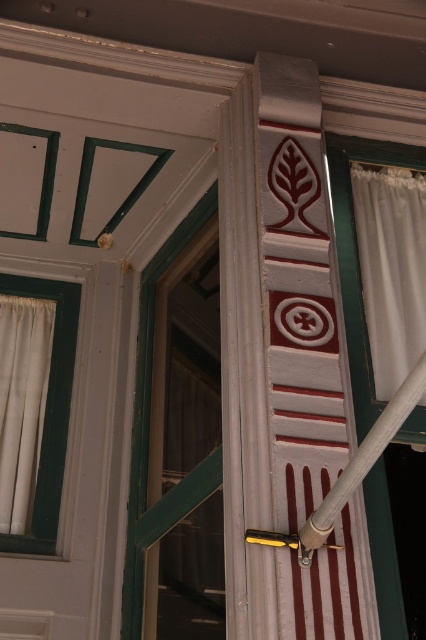
Question: Which of these objects is positioned farthest from the white fabric curtain at left?

Choices:
 (A) white fabric curtain at right
 (B) gray matte pole at center

Answer: (B)

Question: Does white fabric curtain at right have a larger size compared to white fabric curtain at left?

Choices:
 (A) no
 (B) yes

Answer: (B)

Question: Is white fabric curtain at left further to the viewer compared to gray matte pole at center?

Choices:
 (A) no
 (B) yes

Answer: (B)

Question: Which object appears closest to the camera in this image?

Choices:
 (A) green painted wood window at center
 (B) white fabric curtain at left
 (C) gray matte pole at center

Answer: (C)

Question: Among these objects, which one is nearest to the camera?

Choices:
 (A) gray matte pole at center
 (B) white fabric curtain at left
 (C) white fabric curtain at right
 (D) green painted wood window at center

Answer: (A)

Question: Does white fabric curtain at right appear over gray matte pole at center?

Choices:
 (A) yes
 (B) no

Answer: (A)